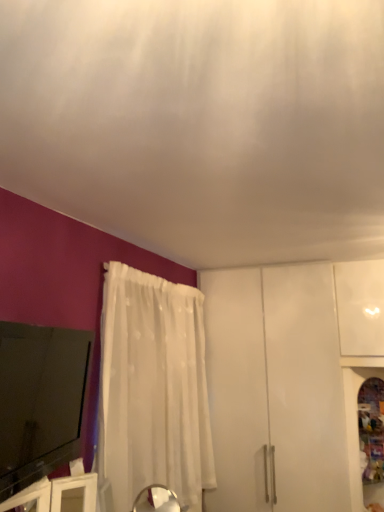
Question: From a real-world perspective, does white sheer curtain at lower center sit lower than white sheer curtain at left?

Choices:
 (A) yes
 (B) no

Answer: (B)

Question: Can you confirm if white sheer curtain at lower center is bigger than white sheer curtain at left?

Choices:
 (A) no
 (B) yes

Answer: (B)

Question: Is white sheer curtain at lower center to the right of white sheer curtain at left from the viewer's perspective?

Choices:
 (A) yes
 (B) no

Answer: (A)

Question: Can you confirm if white sheer curtain at lower center is positioned to the left of white sheer curtain at left?

Choices:
 (A) no
 (B) yes

Answer: (A)

Question: Is white sheer curtain at lower center positioned in front of white sheer curtain at left?

Choices:
 (A) no
 (B) yes

Answer: (B)

Question: Does point (377, 370) appear closer or farther from the camera than point (41, 6)?

Choices:
 (A) closer
 (B) farther

Answer: (B)

Question: Is white glossy cabinet at lower right wider or thinner than white sheer curtain at lower center?

Choices:
 (A) thin
 (B) wide

Answer: (A)

Question: From the image's perspective, is white glossy cabinet at lower right above or below white sheer curtain at lower center?

Choices:
 (A) above
 (B) below

Answer: (B)

Question: Which is correct: white glossy cabinet at lower right is inside white sheer curtain at lower center, or outside of it?

Choices:
 (A) outside
 (B) inside

Answer: (A)

Question: Considering the positions of white sheer curtain at lower center and white sheer curtain at left in the image, is white sheer curtain at lower center taller or shorter than white sheer curtain at left?

Choices:
 (A) short
 (B) tall

Answer: (A)

Question: Would you say white sheer curtain at lower center is to the left or to the right of white sheer curtain at left in the picture?

Choices:
 (A) left
 (B) right

Answer: (B)

Question: Is white sheer curtain at lower center wider or thinner than white sheer curtain at left?

Choices:
 (A) thin
 (B) wide

Answer: (B)

Question: Do you think white sheer curtain at lower center is within white sheer curtain at left, or outside of it?

Choices:
 (A) outside
 (B) inside

Answer: (A)

Question: Considering the positions of white sheer curtain at lower center and black glossy tv at lower left in the image, is white sheer curtain at lower center bigger or smaller than black glossy tv at lower left?

Choices:
 (A) big
 (B) small

Answer: (A)

Question: Considering the relative positions of white sheer curtain at lower center and black glossy tv at lower left in the image provided, is white sheer curtain at lower center to the left or to the right of black glossy tv at lower left?

Choices:
 (A) right
 (B) left

Answer: (A)